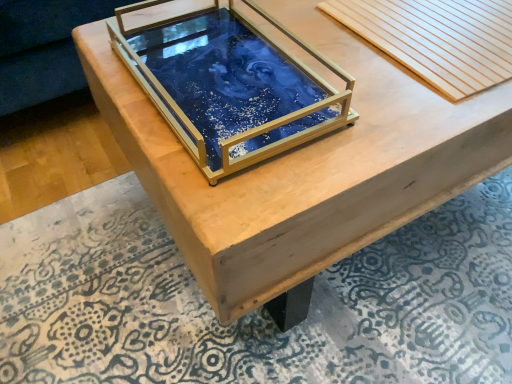
Question: Does wooden table at center have a smaller size compared to blue resin tray at center?

Choices:
 (A) no
 (B) yes

Answer: (A)

Question: Is wooden table at center positioned in front of blue resin tray at center?

Choices:
 (A) yes
 (B) no

Answer: (A)

Question: Considering the relative sizes of wooden table at center and blue resin tray at center in the image provided, is wooden table at center taller than blue resin tray at center?

Choices:
 (A) yes
 (B) no

Answer: (A)

Question: From a real-world perspective, is wooden table at center over blue resin tray at center?

Choices:
 (A) no
 (B) yes

Answer: (B)

Question: Does wooden table at center lie behind blue resin tray at center?

Choices:
 (A) no
 (B) yes

Answer: (A)

Question: Considering the relative sizes of wooden table at center and blue resin tray at center in the image provided, is wooden table at center wider than blue resin tray at center?

Choices:
 (A) yes
 (B) no

Answer: (B)

Question: From the image's perspective, would you say blue resin tray at center is shown under wooden table at center?

Choices:
 (A) no
 (B) yes

Answer: (B)

Question: Can wooden table at center be found inside blue resin tray at center?

Choices:
 (A) yes
 (B) no

Answer: (B)

Question: Is blue resin tray at center turned away from wooden table at center?

Choices:
 (A) yes
 (B) no

Answer: (B)

Question: Is blue resin tray at center placed right next to wooden table at center?

Choices:
 (A) no
 (B) yes

Answer: (B)

Question: Could you tell me if blue resin tray at center is facing wooden table at center?

Choices:
 (A) no
 (B) yes

Answer: (A)

Question: Does blue resin tray at center appear on the left side of wooden table at center?

Choices:
 (A) no
 (B) yes

Answer: (B)

Question: Does blue resin tray at center have a smaller size compared to blue resin tray at center?

Choices:
 (A) yes
 (B) no

Answer: (B)